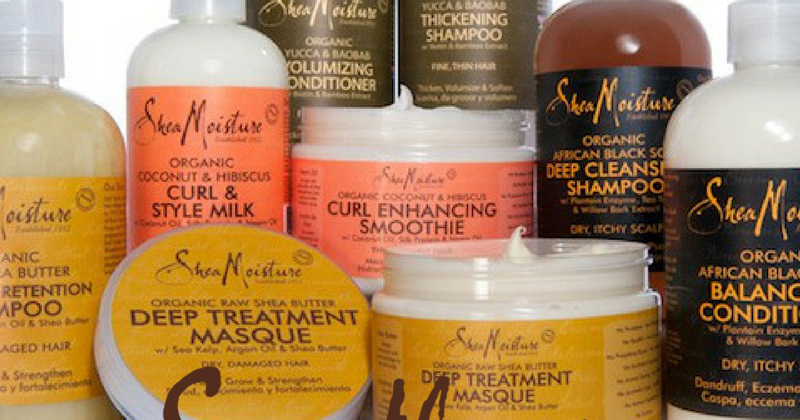
Find the location of `bottles`. bottles is located at coordinates point(462,44), point(581,33), point(333,34), point(222,75), point(74,142), point(746,138).